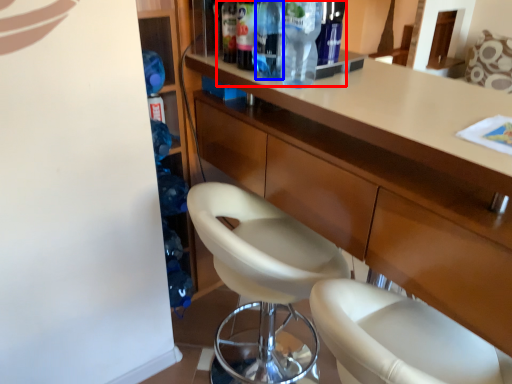
Question: Which object is further to the camera taking this photo, bottle (highlighted by a red box) or bottle (highlighted by a blue box)?

Choices:
 (A) bottle
 (B) bottle

Answer: (B)